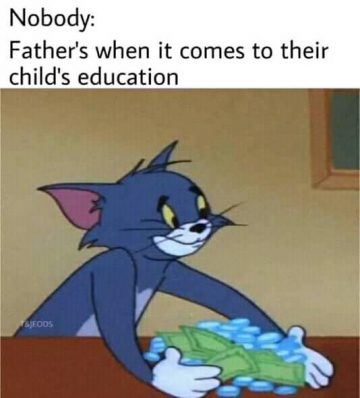
Where is `chalkboard`? Image resolution: width=360 pixels, height=398 pixels. chalkboard is located at coordinates (345, 137).